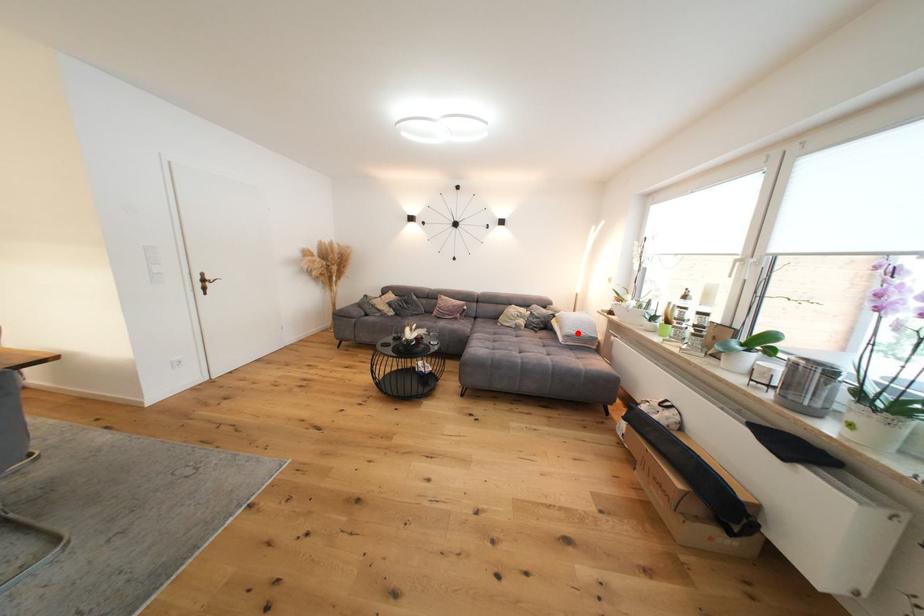
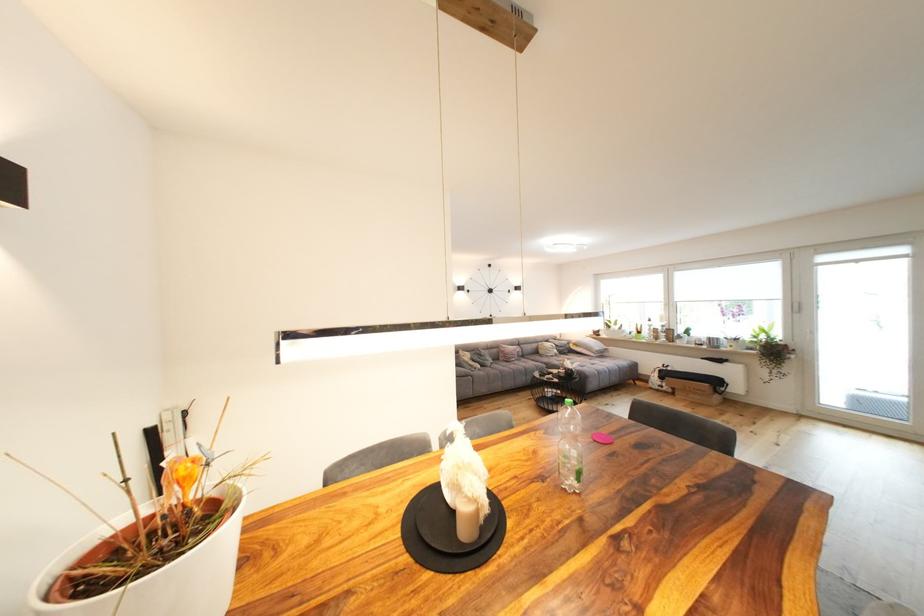
Question: I am providing you with two images of the same scene from different viewpoints. A red point is shown in image1. For the corresponding object point in image2, is it positioned nearer or farther from the camera?

Choices:
 (A) Nearer
 (B) Farther

Answer: (B)